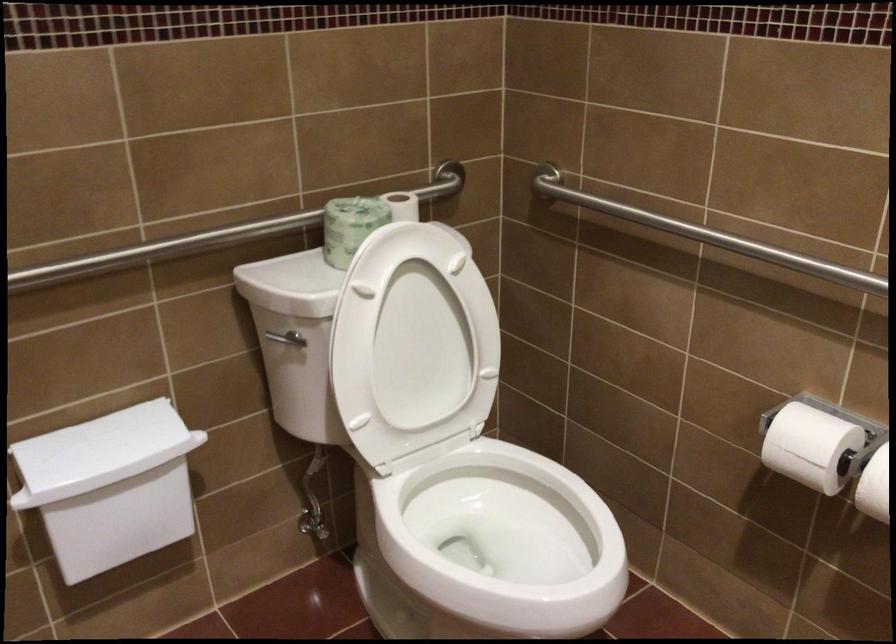
Image resolution: width=896 pixels, height=644 pixels. Describe the element at coordinates (497, 544) in the screenshot. I see `the white toilet seat` at that location.